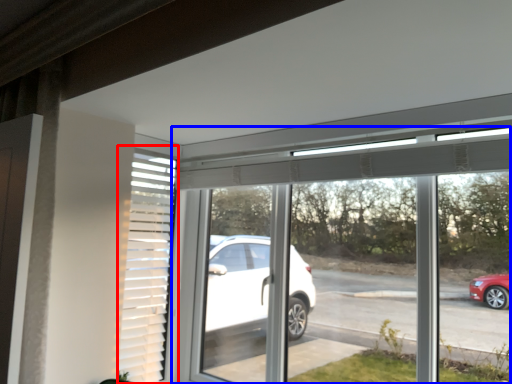
Question: Which object appears farthest to the camera in this image, shutter (highlighted by a red box) or window (highlighted by a blue box)?

Choices:
 (A) shutter
 (B) window

Answer: (A)